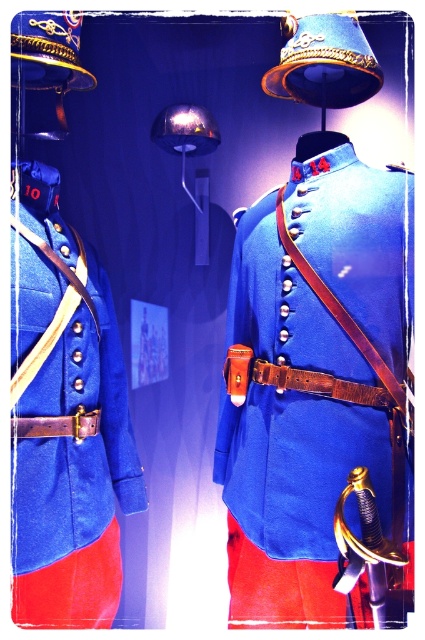
Question: Which point is farther to the camera?

Choices:
 (A) blue woolen coat at center
 (B) matte blue fabric jacket at left
 (C) gold polished metal sword at center

Answer: (B)

Question: Among these points, which one is farthest from the camera?

Choices:
 (A) (295, 397)
 (B) (365, 497)

Answer: (A)

Question: Among these points, which one is nearest to the camera?

Choices:
 (A) pos(402,394)
 (B) pos(110,417)
 (C) pos(405,556)

Answer: (C)

Question: Does matte blue fabric jacket at left appear over gold polished metal sword at center?

Choices:
 (A) yes
 (B) no

Answer: (A)

Question: Can you confirm if blue woolen coat at center is thinner than matte blue fabric jacket at left?

Choices:
 (A) no
 (B) yes

Answer: (A)

Question: From the image, what is the correct spatial relationship of blue woolen coat at center in relation to matte blue fabric jacket at left?

Choices:
 (A) below
 (B) above

Answer: (B)